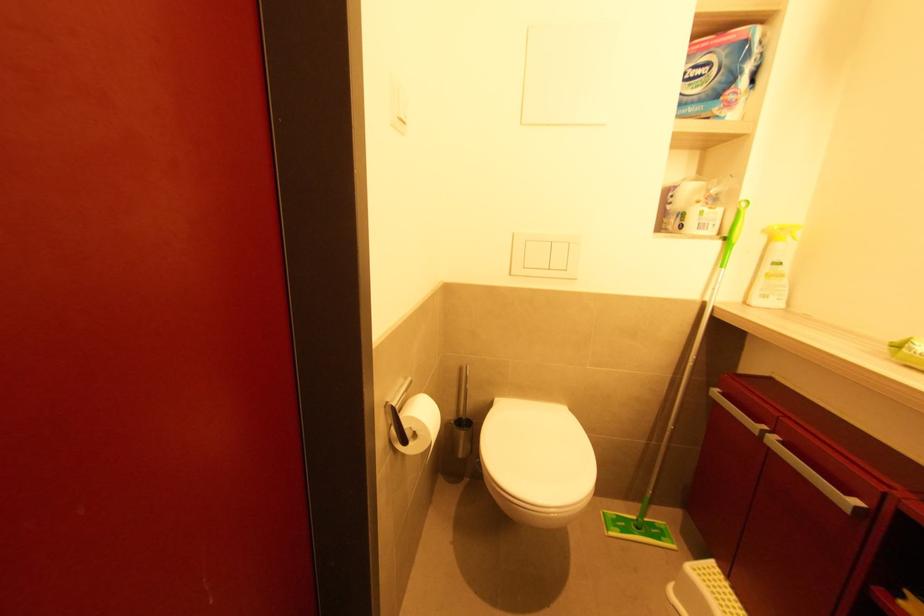
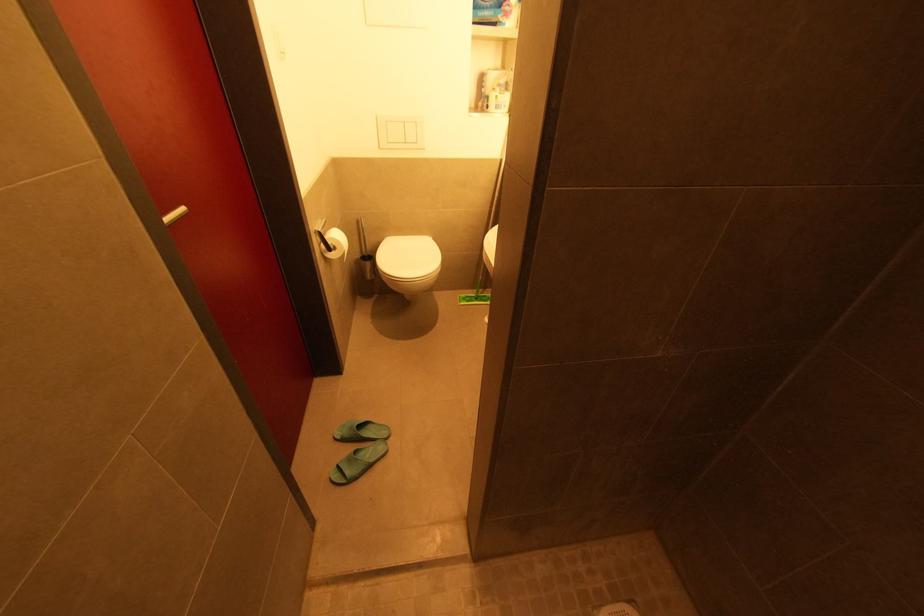
Question: In a continuous first-person perspective shot, in which direction is the camera moving?

Choices:
 (A) Left
 (B) Right
 (C) Forward
 (D) Backward

Answer: (D)